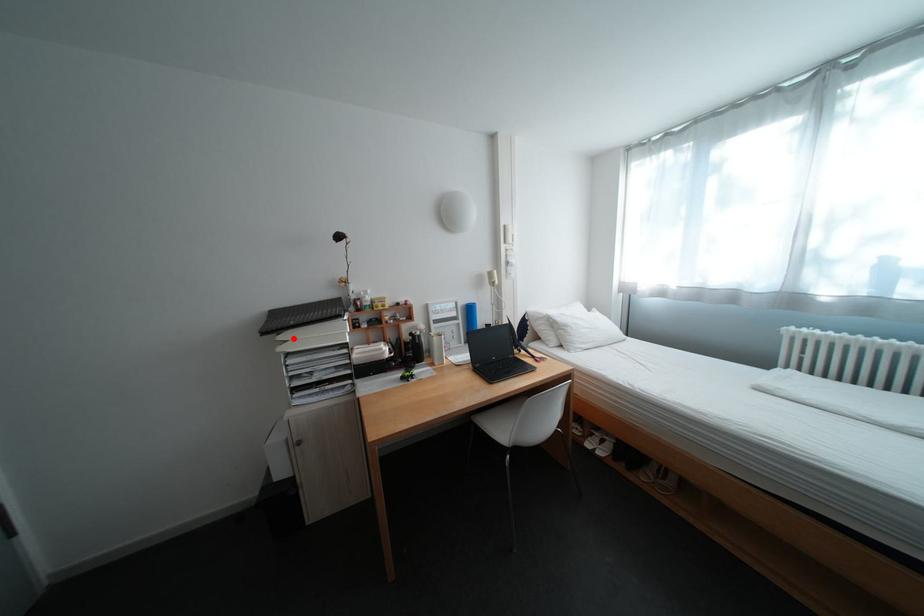
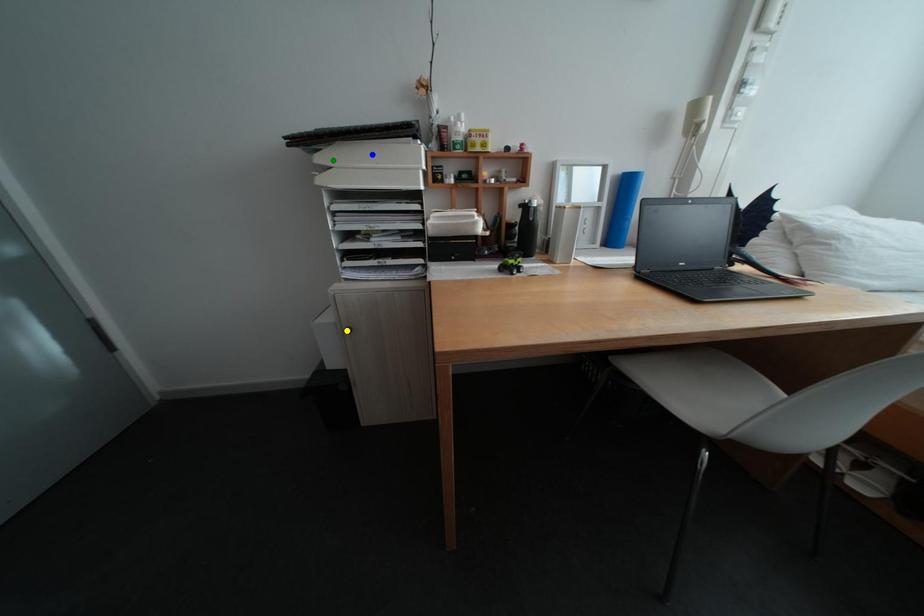
Question: I am providing you with two images of the same scene from different viewpoints. A red point is marked on the first image. You are given multiple points on the second image. Can you choose the point in image 2 that corresponds to the point in image 1?

Choices:
 (A) blue point
 (B) yellow point
 (C) green point

Answer: (C)